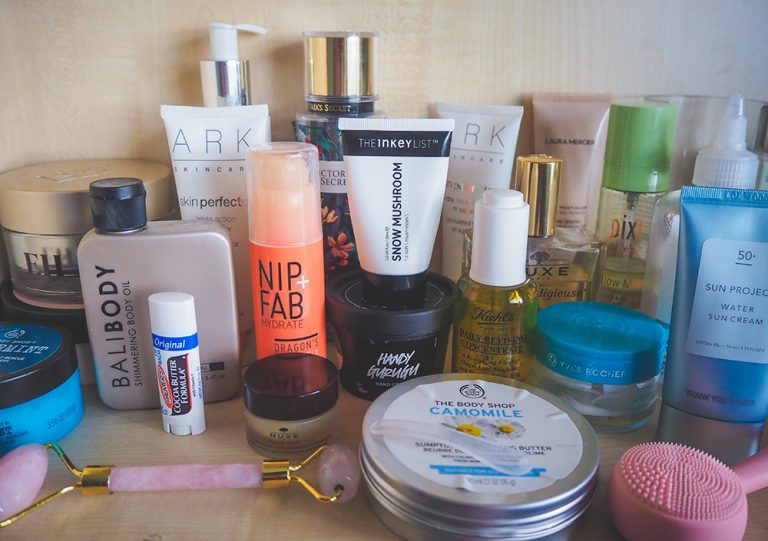
The height and width of the screenshot is (541, 768). What are the coordinates of `containers or bottles glass clear` in the screenshot? It's located at (637, 406), (627, 254), (574, 262), (500, 318), (332, 142), (41, 241), (295, 433).